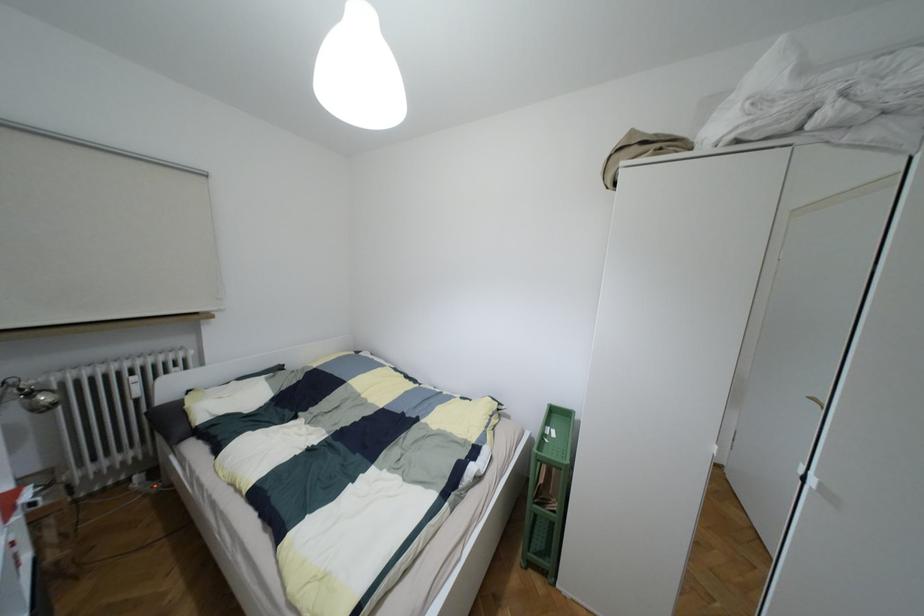
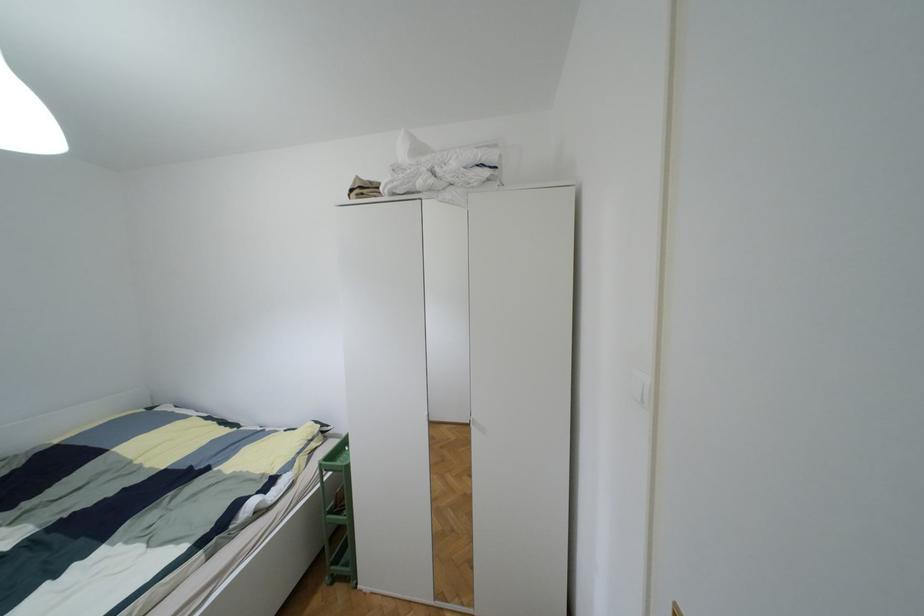
The point at (528, 565) is marked in the first image. Where is the corresponding point in the second image?

(333, 578)